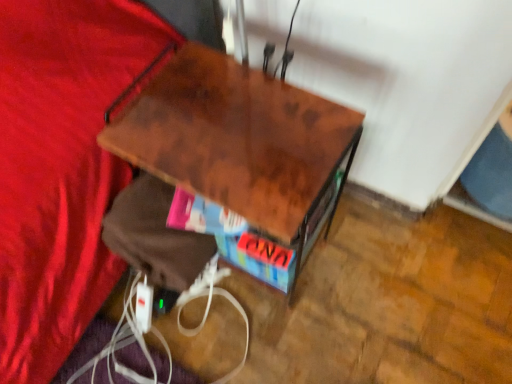
What are the coordinates of `vacant space to the right of wooden desk at center` in the screenshot? It's located at (378, 263).